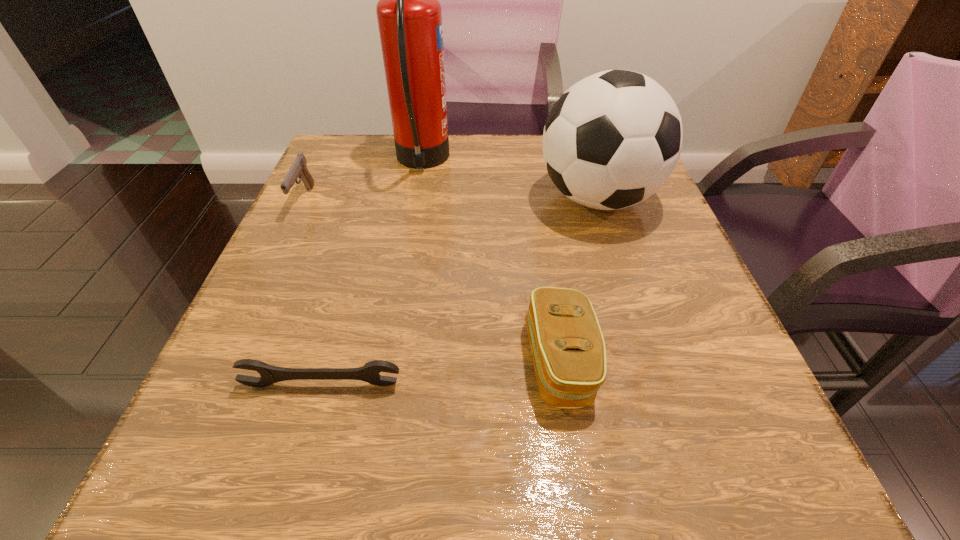
I want to click on free space at the far edge, so click(x=469, y=147).

Identify the location of free space at the left edge of the desktop. The height and width of the screenshot is (540, 960). (265, 430).

Where is `vacant space at the right edge`? The image size is (960, 540). vacant space at the right edge is located at coordinates (708, 373).

In the image, there is a desktop. Where is `vacant space at the far left corner`? Image resolution: width=960 pixels, height=540 pixels. vacant space at the far left corner is located at coordinates (341, 186).

In the image, there is a desktop. Where is `free space at the near right corner`? The width and height of the screenshot is (960, 540). free space at the near right corner is located at coordinates (742, 503).

Image resolution: width=960 pixels, height=540 pixels. I want to click on free space between the soccer ball and the pistol, so click(x=451, y=199).

At what (x,y) coordinates should I click in order to perform the action: click on vacant area between the shortest object and the clutch bag. Please return your answer as a coordinate pair (x, y). The height and width of the screenshot is (540, 960). Looking at the image, I should click on (441, 373).

Find the location of `free space that is in between the tallest object and the clutch bag`. free space that is in between the tallest object and the clutch bag is located at coordinates (491, 262).

This screenshot has width=960, height=540. Find the location of `free area in between the shortest object and the pistol`. free area in between the shortest object and the pistol is located at coordinates (313, 292).

Where is `free area in between the leftmost object and the clutch bag`? This screenshot has width=960, height=540. free area in between the leftmost object and the clutch bag is located at coordinates (432, 281).